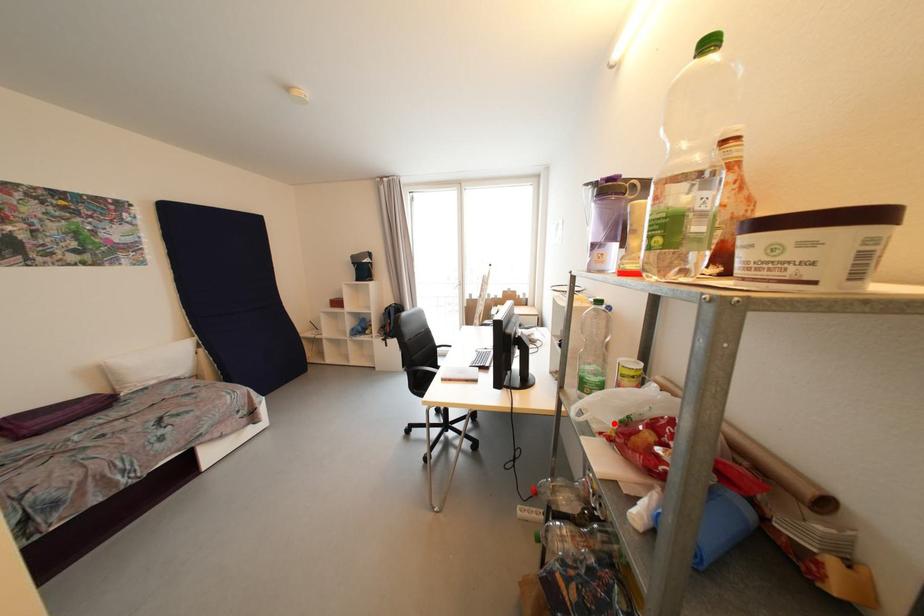
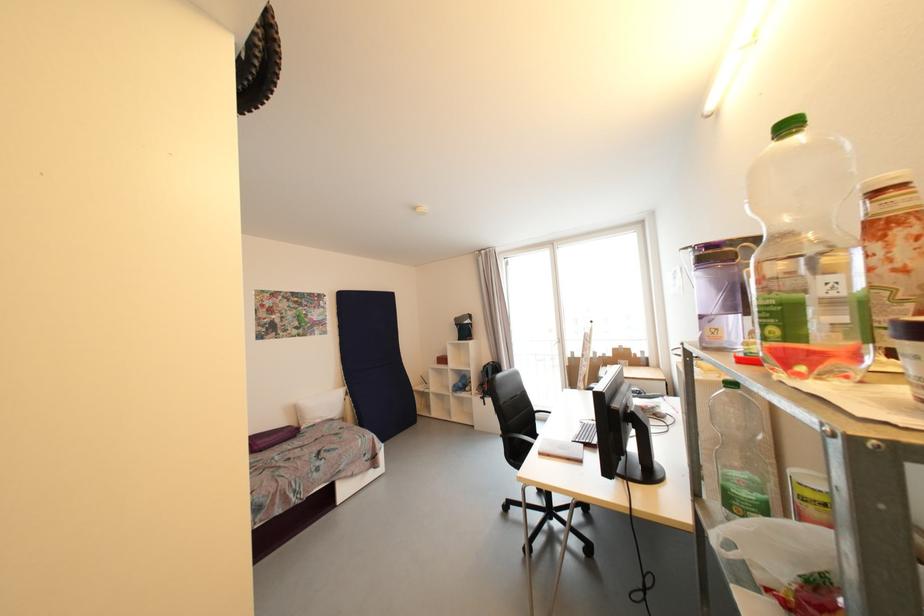
Where in the second image is the point corresponding to the highlighted location from the first image?

(784, 575)